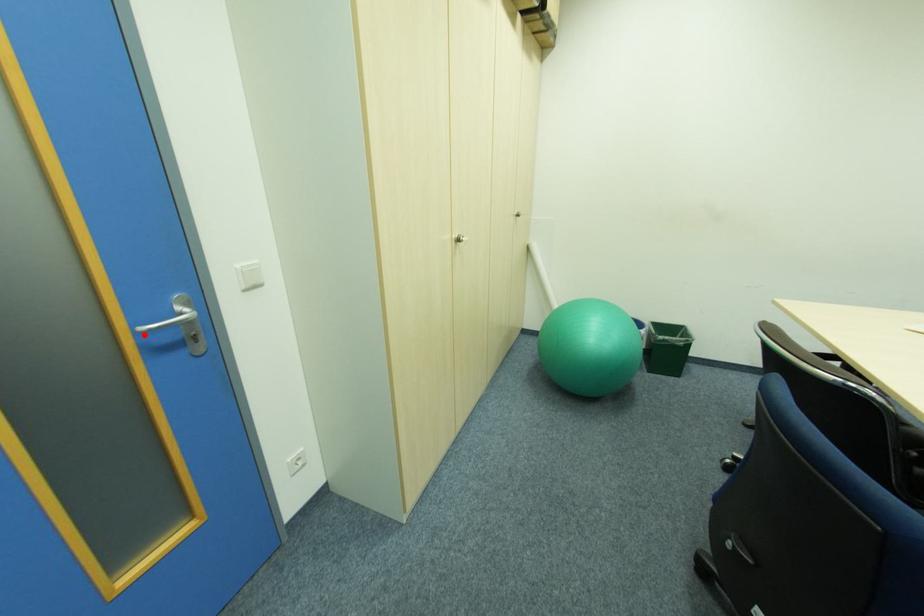
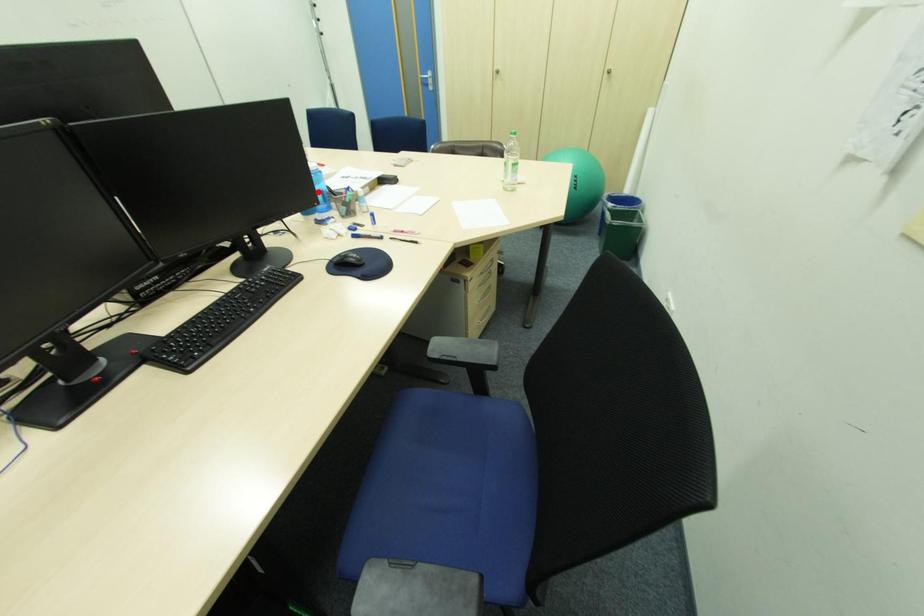
I am providing you with two images of the same scene from different viewpoints. A red point is marked on the first image and another point is marked on the second image. Is the marked point in image1 the same physical position as the marked point in image2?

No